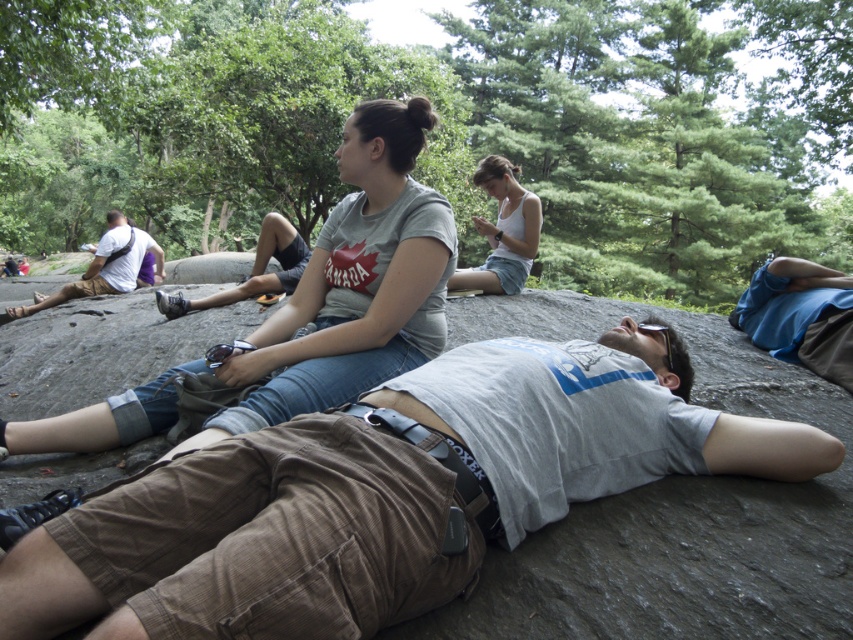
The width and height of the screenshot is (853, 640). Identify the location of light brown corduroy shorts at center. (387, 492).

Which is behind, point (194, 577) or point (7, 438)?

The point (7, 438) is behind.

Is point (329, 477) positioned before point (318, 339)?

Yes, point (329, 477) is closer to viewer.

This screenshot has height=640, width=853. Identify the location of light brown corduroy shorts at center. (387, 492).

Is gray cotton t-shirt at upper center to the left of white cotton tank top at center from the viewer's perspective?

Yes, gray cotton t-shirt at upper center is to the left of white cotton tank top at center.

What do you see at coordinates (357, 280) in the screenshot? I see `gray cotton t-shirt at upper center` at bounding box center [357, 280].

You are a GUI agent. You are given a task and a screenshot of the screen. Output one action in this format:
    pyautogui.click(x=<x>, y=<y>)
    Task: Click on the gray cotton t-shirt at upper center
    Image resolution: width=853 pixels, height=640 pixels.
    Given the screenshot: What is the action you would take?
    pyautogui.click(x=357, y=280)

Is gray cotton t-shirt at upper center taller than black rubber goggles at center?

Indeed, gray cotton t-shirt at upper center has a greater height compared to black rubber goggles at center.

Is gray cotton t-shirt at upper center wider than black rubber goggles at center?

Yes, gray cotton t-shirt at upper center is wider than black rubber goggles at center.

What do you see at coordinates (357, 280) in the screenshot? This screenshot has width=853, height=640. I see `gray cotton t-shirt at upper center` at bounding box center [357, 280].

Locate an element on the screen. The height and width of the screenshot is (640, 853). gray cotton t-shirt at upper center is located at coordinates (357, 280).